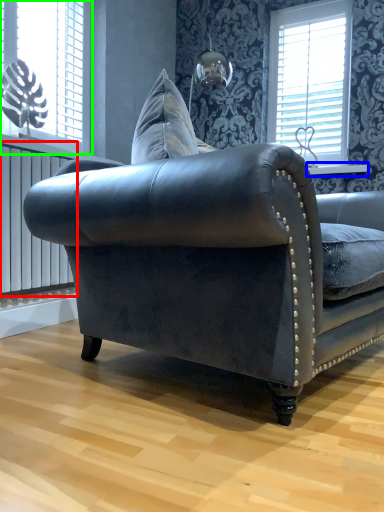
Question: Which object is the farthest from radiator (highlighted by a red box)? Choose among these: window sill (highlighted by a blue box) or window (highlighted by a green box).

Choices:
 (A) window sill
 (B) window

Answer: (A)